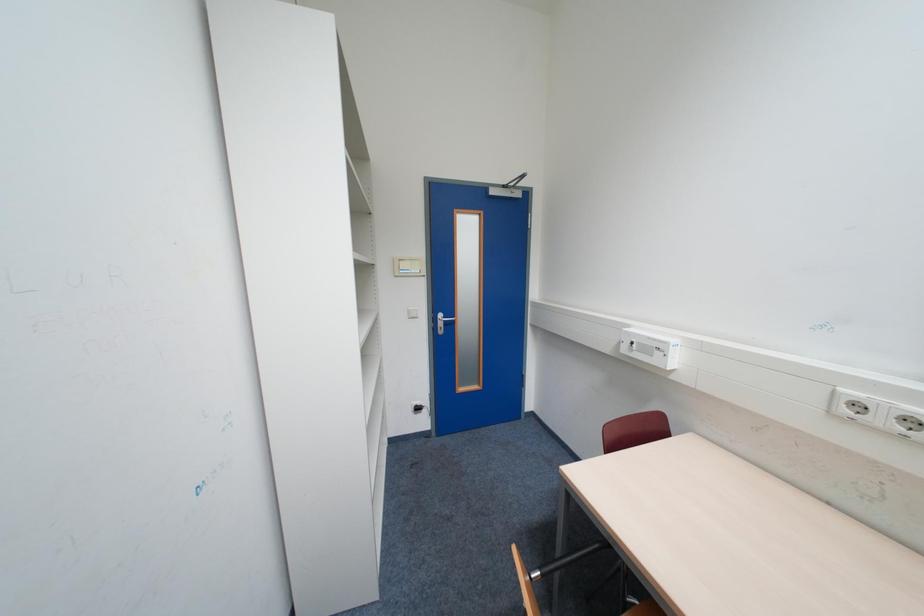
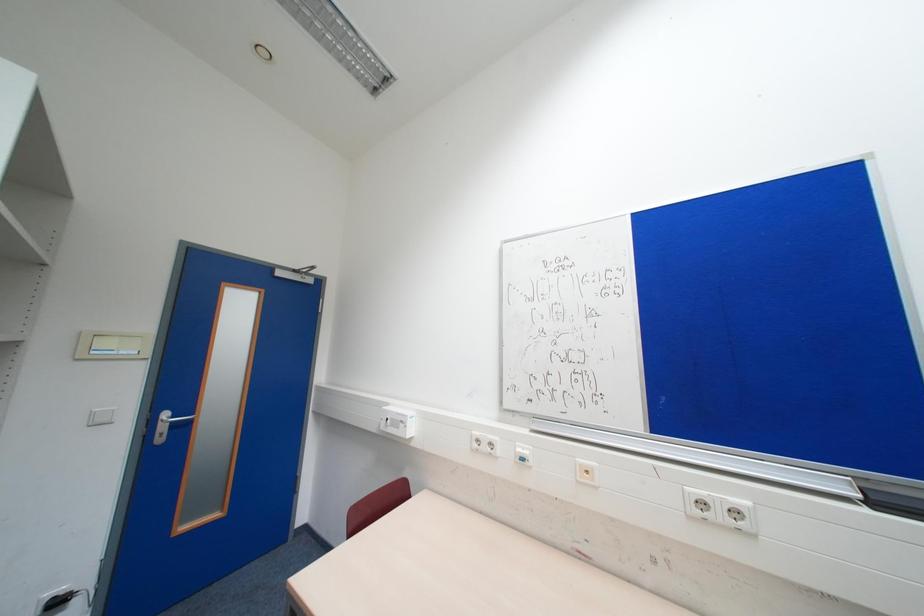
First-person continuous shooting, in which direction is the camera rotating?

The rotation direction of the camera is right-up.